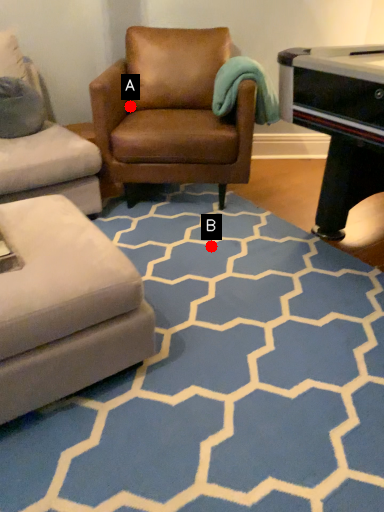
Question: Two points are circled on the image, labeled by A and B beside each circle. Which point is closer to the camera?

Choices:
 (A) A is closer
 (B) B is closer

Answer: (B)